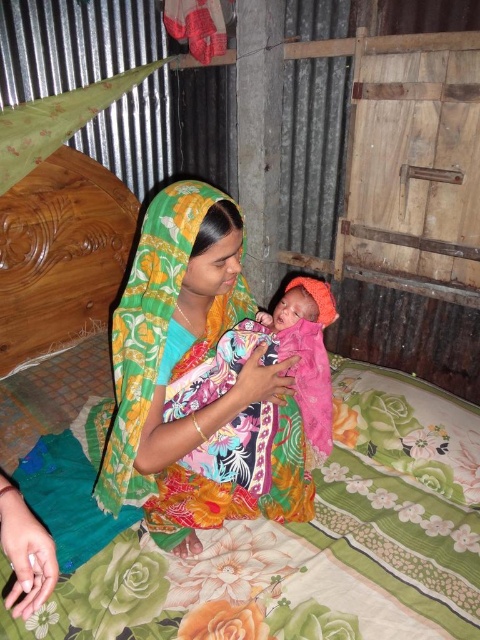
Based on the coordinates provided, which object is located at point (312, 541) in the scene?

The point (312, 541) corresponds to the floral fabric quilt at center.

You are a visitor in this home and want to know which item is underneath the other between the floral fabric quilt at center and the orange fabric swaddle at center. Can you tell me which one is underneath?

The floral fabric quilt at center is positioned under the orange fabric swaddle at center, so the quilt is underneath the swaddle.

You are a photographer trying to capture the baby in the image. Which fabric is nearer to the camera, the floral fabric cloth at center or the orange fabric swaddle at center?

The floral fabric cloth at center is closer to the viewer than the orange fabric swaddle at center, so the floral fabric cloth at center will appear nearer to the camera.